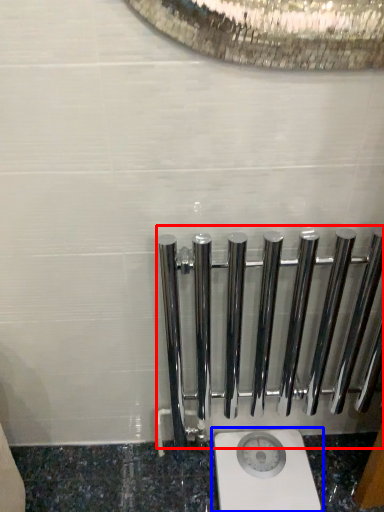
Question: Which object is closer to the camera taking this photo, rail (highlighted by a red box) or toilet (highlighted by a blue box)?

Choices:
 (A) rail
 (B) toilet

Answer: (A)